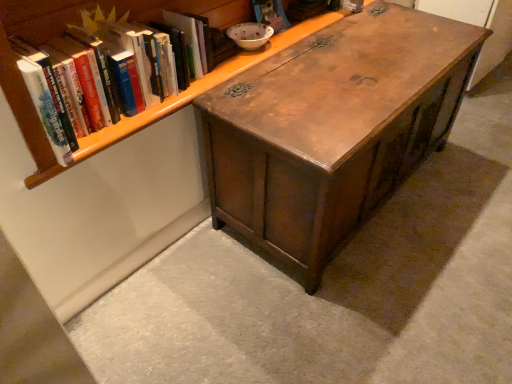
Question: Can you confirm if wooden chest at center is bigger than wooden bookshelf at upper left?

Choices:
 (A) yes
 (B) no

Answer: (A)

Question: Can we say wooden chest at center lies outside wooden bookshelf at upper left?

Choices:
 (A) no
 (B) yes

Answer: (B)

Question: Could you tell me if wooden chest at center is turned towards wooden bookshelf at upper left?

Choices:
 (A) yes
 (B) no

Answer: (B)

Question: Is wooden chest at center taller than wooden bookshelf at upper left?

Choices:
 (A) no
 (B) yes

Answer: (B)

Question: Would you say wooden chest at center is a long distance from wooden bookshelf at upper left?

Choices:
 (A) no
 (B) yes

Answer: (A)

Question: Is the surface of wooden chest at center in direct contact with wooden bookshelf at upper left?

Choices:
 (A) no
 (B) yes

Answer: (A)

Question: Is wooden bookshelf at upper left directly adjacent to hardcover book at upper left?

Choices:
 (A) no
 (B) yes

Answer: (A)

Question: Is wooden bookshelf at upper left facing towards hardcover book at upper left?

Choices:
 (A) yes
 (B) no

Answer: (A)

Question: From the image's perspective, would you say wooden bookshelf at upper left is shown under hardcover book at upper left?

Choices:
 (A) no
 (B) yes

Answer: (A)

Question: Is wooden bookshelf at upper left thinner than hardcover book at upper left?

Choices:
 (A) yes
 (B) no

Answer: (B)

Question: From the image's perspective, is wooden bookshelf at upper left on top of hardcover book at upper left?

Choices:
 (A) no
 (B) yes

Answer: (B)

Question: Is wooden bookshelf at upper left closer to camera compared to hardcover book at upper left?

Choices:
 (A) yes
 (B) no

Answer: (A)

Question: From a real-world perspective, is hardcover book at upper left on top of wooden chest at center?

Choices:
 (A) yes
 (B) no

Answer: (A)